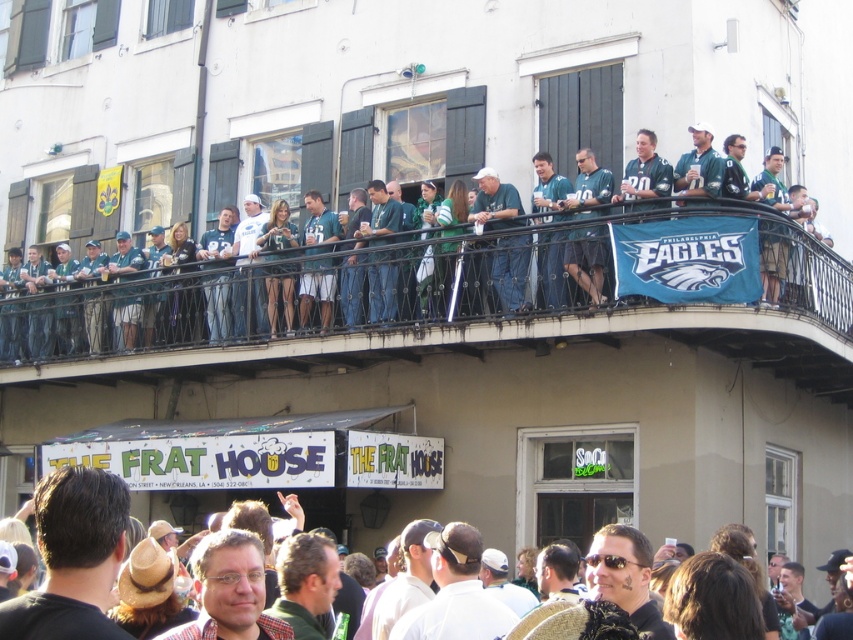
You are a photographer trying to capture a clear shot of the matte green jersey at center and the dark brown leather jacket at center from the front. Since you want both items to appear similarly sized in your photo, which object should you move closer to and which should you move farther away?

The matte green jersey at center is larger in size than the dark brown leather jacket at center. To make them appear similar in size in the photo, move closer to the dark brown leather jacket at center and farther away from the matte green jersey at center.

You are standing in front of the balcony at the event and want to hand a gift to the person wearing the matte green jersey at center and the dark brown leather jacket at center. Which one can you reach first without moving your position?

The matte green jersey at center is closer to you than the dark brown leather jacket at center, so you can reach the person wearing the matte green jersey at center first without moving.